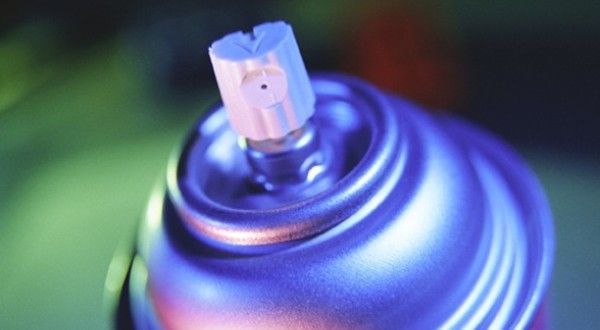
The height and width of the screenshot is (330, 600). Identify the location of green lights. (65, 195).